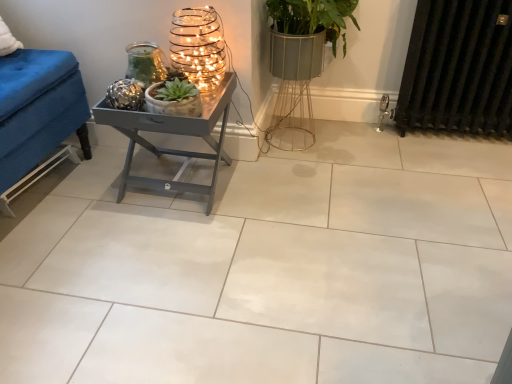
What do you see at coordinates (172, 133) in the screenshot?
I see `metallic gray table at center` at bounding box center [172, 133].

Locate an element on the screen. Image resolution: width=512 pixels, height=384 pixels. black metal radiator at right is located at coordinates (458, 68).

How much space does metallic textured candle holder at upper center, marked as the first candle holder in a left-to-right arrangement, occupy horizontally?

5.82 inches.

The width and height of the screenshot is (512, 384). Find the location of `metallic wire candle holder at upper left, arranged as the 2th candle holder when viewed from the left`. metallic wire candle holder at upper left, arranged as the 2th candle holder when viewed from the left is located at coordinates (198, 46).

At what (x,y) coordinates should I click in order to perform the action: click on metallic gray table at center. Please return your answer as a coordinate pair (x, y). Looking at the image, I should click on (172, 133).

From the image's perspective, is metallic gray table at center located beneath metallic wire candle holder at upper left, arranged as the 2th candle holder when viewed from the left?

Indeed, from the image's perspective, metallic gray table at center is shown beneath metallic wire candle holder at upper left, arranged as the 2th candle holder when viewed from the left.

From a real-world perspective, is metallic gray table at center positioned above or below metallic wire candle holder at upper left, arranged as the 1th candle holder when viewed from the right?

In terms of real-world spatial position, metallic gray table at center is below metallic wire candle holder at upper left, arranged as the 1th candle holder when viewed from the right.

Between metallic gray table at center and metallic wire candle holder at upper left, arranged as the 1th candle holder when viewed from the right, which one is positioned behind?

Positioned behind is metallic wire candle holder at upper left, arranged as the 1th candle holder when viewed from the right.

Looking at their sizes, would you say metallic gray table at center is wider or thinner than metallic wire candle holder at upper left, arranged as the 2th candle holder when viewed from the left?

metallic gray table at center is wider than metallic wire candle holder at upper left, arranged as the 2th candle holder when viewed from the left.

Considering the relative sizes of white glossy tile at center and green matte succulent at center in the image provided, is white glossy tile at center smaller than green matte succulent at center?

No, white glossy tile at center is not smaller than green matte succulent at center.

What's the angular difference between white glossy tile at center and green matte succulent at center's facing directions?

white glossy tile at center and green matte succulent at center are facing 0.832 degrees away from each other.

From the picture: Which is less distant, (307, 339) or (184, 115)?

→ Point (307, 339) is closer to the camera than point (184, 115).

Is white glossy tile at center completely or partially outside of green matte succulent at center?

Yes, white glossy tile at center is located beyond the bounds of green matte succulent at center.

Is black metal radiator at right to the left of metallic textured candle holder at upper center, marked as the first candle holder in a left-to-right arrangement, from the viewer's perspective?

No, black metal radiator at right is not to the left of metallic textured candle holder at upper center, marked as the first candle holder in a left-to-right arrangement.

Is black metal radiator at right with metallic textured candle holder at upper center, marked as the first candle holder in a left-to-right arrangement?

No.

How different are the orientations of black metal radiator at right and metallic textured candle holder at upper center, the 2th candle holder when ordered from right to left, in degrees?

1.15 degrees separate the facing orientations of black metal radiator at right and metallic textured candle holder at upper center, the 2th candle holder when ordered from right to left.

Considering the points (179, 28) and (185, 83), which point is behind, point (179, 28) or point (185, 83)?

The point (179, 28) is behind.

Is metallic wire candle holder at upper left, arranged as the 1th candle holder when viewed from the right, to the left or to the right of green matte succulent at center in the image?

In the image, metallic wire candle holder at upper left, arranged as the 1th candle holder when viewed from the right, appears on the right side of green matte succulent at center.

Who is shorter, green matte succulent at center or metallic wire candle holder at upper left, arranged as the 1th candle holder when viewed from the right?

Standing shorter between the two is green matte succulent at center.

Is green matte succulent at center spatially inside metallic wire candle holder at upper left, arranged as the 1th candle holder when viewed from the right, or outside of it?

The correct answer is: outside.

Who is smaller, green matte succulent at center or metallic wire candle holder at upper left, arranged as the 2th candle holder when viewed from the left?

green matte succulent at center is smaller.

From the image's perspective, between green matte succulent at center and metallic wire candle holder at upper left, arranged as the 2th candle holder when viewed from the left, who is located below?

green matte succulent at center appears lower in the image.

Is black metal radiator at right wider than green matte succulent at center?

No, black metal radiator at right is not wider than green matte succulent at center.

How different are the orientations of black metal radiator at right and green matte succulent at center in degrees?

black metal radiator at right and green matte succulent at center are facing 0.991 degrees away from each other.

From a real-world perspective, relative to green matte succulent at center, is black metal radiator at right vertically above or below?

From a real-world perspective, black metal radiator at right is physically below green matte succulent at center.

Identify the location of radiator behind the green matte succulent at center. The height and width of the screenshot is (384, 512). (458, 68).

Which point is more distant from viewer, (159,58) or (192,58)?

Point (159,58)

Is metallic textured candle holder at upper center, marked as the first candle holder in a left-to-right arrangement, facing towards metallic wire candle holder at upper left, arranged as the 2th candle holder when viewed from the left?

No, metallic textured candle holder at upper center, marked as the first candle holder in a left-to-right arrangement, is not turned towards metallic wire candle holder at upper left, arranged as the 2th candle holder when viewed from the left.

Measure the distance from metallic textured candle holder at upper center, marked as the first candle holder in a left-to-right arrangement, to metallic wire candle holder at upper left, arranged as the 1th candle holder when viewed from the right.

metallic textured candle holder at upper center, marked as the first candle holder in a left-to-right arrangement, and metallic wire candle holder at upper left, arranged as the 1th candle holder when viewed from the right, are 5.33 inches apart from each other.

What's the angular difference between metallic textured candle holder at upper center, marked as the first candle holder in a left-to-right arrangement, and metallic wire candle holder at upper left, arranged as the 1th candle holder when viewed from the right,'s facing directions?

0.737 degrees.

Where is `the 1st candle holder behind when counting from the metallic gray table at center`? The image size is (512, 384). the 1st candle holder behind when counting from the metallic gray table at center is located at coordinates coord(198,46).

The height and width of the screenshot is (384, 512). I want to click on ceramic tile in front of the green matte succulent at center, so click(271, 269).

When comparing their distances from metallic gray table at center, does black metal radiator at right or white glossy tile at center seem closer?

white glossy tile at center is closer to metallic gray table at center.

In the scene shown: Estimate the real-world distances between objects in this image. Which object is closer to metallic gray table at center, white glossy tile at center or metallic wire candle holder at upper left, arranged as the 1th candle holder when viewed from the right?

metallic wire candle holder at upper left, arranged as the 1th candle holder when viewed from the right, is closer to metallic gray table at center.

In the scene shown: Looking at the image, which one is located closer to black metal radiator at right, metallic textured candle holder at upper center, the 2th candle holder when ordered from right to left, or metallic wire candle holder at upper left, arranged as the 1th candle holder when viewed from the right?

Among the two, metallic wire candle holder at upper left, arranged as the 1th candle holder when viewed from the right, is located nearer to black metal radiator at right.

In the scene shown: Based on their spatial positions, is white glossy tile at center or metallic wire candle holder at upper left, arranged as the 1th candle holder when viewed from the right, closer to green matte succulent at center?

The object closer to green matte succulent at center is metallic wire candle holder at upper left, arranged as the 1th candle holder when viewed from the right.

Consider the image. Looking at the image, which one is located further to metallic wire candle holder at upper left, arranged as the 2th candle holder when viewed from the left, metallic textured candle holder at upper center, the 2th candle holder when ordered from right to left, or green matte succulent at center?

green matte succulent at center is positioned further to the anchor metallic wire candle holder at upper left, arranged as the 2th candle holder when viewed from the left.

Estimate the real-world distances between objects in this image. Which object is closer to metallic wire candle holder at upper left, arranged as the 2th candle holder when viewed from the left, white glossy tile at center or metallic gray table at center?

The object closer to metallic wire candle holder at upper left, arranged as the 2th candle holder when viewed from the left, is metallic gray table at center.

Estimate the real-world distances between objects in this image. Which object is further from metallic textured candle holder at upper center, the 2th candle holder when ordered from right to left, metallic wire candle holder at upper left, arranged as the 1th candle holder when viewed from the right, or black metal radiator at right?

black metal radiator at right.

Looking at the image, which one is located further to metallic wire candle holder at upper left, arranged as the 1th candle holder when viewed from the right, white glossy tile at center or metallic textured candle holder at upper center, marked as the first candle holder in a left-to-right arrangement?

Based on the image, white glossy tile at center appears to be further to metallic wire candle holder at upper left, arranged as the 1th candle holder when viewed from the right.

Where is `ceramic tile located between metallic wire candle holder at upper left, arranged as the 1th candle holder when viewed from the right, and black metal radiator at right in the left-right direction`? This screenshot has width=512, height=384. ceramic tile located between metallic wire candle holder at upper left, arranged as the 1th candle holder when viewed from the right, and black metal radiator at right in the left-right direction is located at coordinates (271, 269).

Identify the location of ceramic tile between green matte succulent at center and black metal radiator at right from left to right. (271, 269).

This screenshot has height=384, width=512. What are the coordinates of `table located between metallic textured candle holder at upper center, the 2th candle holder when ordered from right to left, and black metal radiator at right in the left-right direction` in the screenshot? It's located at (172, 133).

The height and width of the screenshot is (384, 512). In order to click on houseplant between white glossy tile at center and metallic gray table at center along the z-axis in this screenshot , I will do `click(174, 98)`.